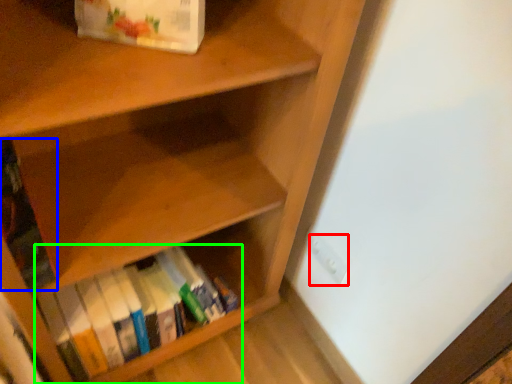
Question: Based on their relative distances, which object is nearer to electric outlet (highlighted by a red box)? Choose from book (highlighted by a blue box) and book (highlighted by a green box).

Choices:
 (A) book
 (B) book

Answer: (B)